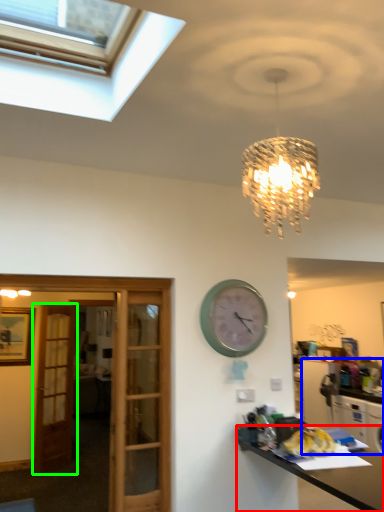
Question: Based on their relative distances, which object is farther from desk (highlighted by a red box)? Choose from cabinetry (highlighted by a blue box) and door (highlighted by a green box).

Choices:
 (A) cabinetry
 (B) door

Answer: (A)